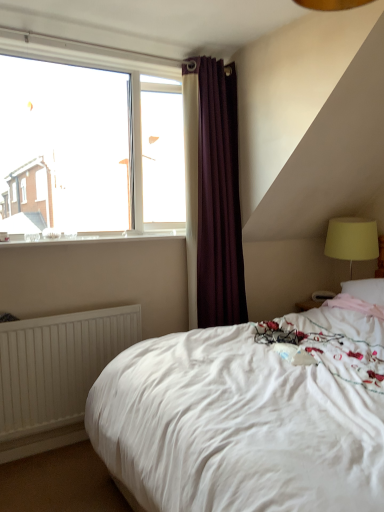
Consider the image. Measure the distance between dark purple velvet curtain at upper center and camera.

dark purple velvet curtain at upper center and camera are 8.39 feet apart.

This screenshot has width=384, height=512. I want to click on clear glass window at upper left, so click(x=89, y=148).

Image resolution: width=384 pixels, height=512 pixels. I want to click on white glossy window sill at upper left, so click(x=90, y=238).

Considering the relative sizes of clear glass window at upper left and white matte radiator at lower left in the image provided, is clear glass window at upper left smaller than white matte radiator at lower left?

No, clear glass window at upper left is not smaller than white matte radiator at lower left.

Is clear glass window at upper left in front of or behind white matte radiator at lower left in the image?

In the image, clear glass window at upper left appears behind white matte radiator at lower left.

Considering the sizes of objects white glossy window sill at upper left and yellow fabric lampshade at right in the image provided, who is thinner, white glossy window sill at upper left or yellow fabric lampshade at right?

With smaller width is white glossy window sill at upper left.

Is white glossy window sill at upper left at the right side of yellow fabric lampshade at right?

No.

At what (x,y) coordinates should I click in order to perform the action: click on lamp beneath the white glossy window sill at upper left (from a real-world perspective). Please return your answer as a coordinate pair (x, y). This screenshot has height=512, width=384. Looking at the image, I should click on (352, 240).

Based on the photo, is the position of clear glass window at upper left more distant than that of yellow fabric lampshade at right?

That is False.

Is clear glass window at upper left wider than yellow fabric lampshade at right?

No, clear glass window at upper left is not wider than yellow fabric lampshade at right.

Considering the relative sizes of clear glass window at upper left and yellow fabric lampshade at right in the image provided, is clear glass window at upper left taller than yellow fabric lampshade at right?

Yes.

Considering the relative sizes of clear glass window at upper left and yellow fabric lampshade at right in the image provided, is clear glass window at upper left bigger than yellow fabric lampshade at right?

Yes, clear glass window at upper left is bigger than yellow fabric lampshade at right.

Is white soft bed at center not inside dark purple velvet curtain at upper center?

white soft bed at center lies outside dark purple velvet curtain at upper center's area.

How far apart are white soft bed at center and dark purple velvet curtain at upper center?

white soft bed at center and dark purple velvet curtain at upper center are 3.74 feet apart from each other.

Which object is thinner, white soft bed at center or dark purple velvet curtain at upper center?

With smaller width is dark purple velvet curtain at upper center.

Is point (156, 499) positioned after point (206, 324)?

That is False.

Is yellow fabric lampshade at right taller or shorter than clear glass window at upper left?

In the image, yellow fabric lampshade at right appears to be shorter than clear glass window at upper left.

Does yellow fabric lampshade at right touch clear glass window at upper left?

No, yellow fabric lampshade at right is not touching clear glass window at upper left.

Can you tell me how much yellow fabric lampshade at right and clear glass window at upper left differ in facing direction?

The angle between the facing direction of yellow fabric lampshade at right and the facing direction of clear glass window at upper left is 88 degrees.

From a real-world perspective, is yellow fabric lampshade at right physically above clear glass window at upper left?

Actually, yellow fabric lampshade at right is physically below clear glass window at upper left in the real world.

Considering the relative sizes of white soft bed at center and yellow fabric lampshade at right in the image provided, is white soft bed at center shorter than yellow fabric lampshade at right?

Incorrect, the height of white soft bed at center does not fall short of that of yellow fabric lampshade at right.

Are white soft bed at center and yellow fabric lampshade at right making contact?

No, white soft bed at center is not making contact with yellow fabric lampshade at right.

Which object is more forward, white soft bed at center or yellow fabric lampshade at right?

white soft bed at center is more forward.

At what (x,y) coordinates should I click in order to perform the action: click on lamp located above the white soft bed at center (from the image's perspective). Please return your answer as a coordinate pair (x, y). Image resolution: width=384 pixels, height=512 pixels. Looking at the image, I should click on (352, 240).

This screenshot has height=512, width=384. Identify the location of radiator below the white soft bed at center (from a real-world perspective). (57, 366).

Between white matte radiator at lower left and white soft bed at center, which one has larger size?

white soft bed at center is bigger.

In the scene shown: From the image's perspective, who appears lower, white matte radiator at lower left or white soft bed at center?

From the image's view, white matte radiator at lower left is below.

What are the coordinates of `window that is above the white matte radiator at lower left (from the image's perspective)` in the screenshot? It's located at (89, 148).

You are a GUI agent. You are given a task and a screenshot of the screen. Output one action in this format:
    pyautogui.click(x=<x>, y=<y>)
    Task: Click on the window sill above the yellow fabric lampshade at right (from a real-world perspective)
    Image resolution: width=384 pixels, height=512 pixels.
    Given the screenshot: What is the action you would take?
    pyautogui.click(x=90, y=238)

From the image, which object appears to be farther from dark purple velvet curtain at upper center, yellow fabric lampshade at right or white soft bed at center?

white soft bed at center is further to dark purple velvet curtain at upper center.

When comparing their distances from white glossy window sill at upper left, does yellow fabric lampshade at right or white soft bed at center seem closer?

white soft bed at center.

Considering their positions, is white matte radiator at lower left positioned further to yellow fabric lampshade at right than dark purple velvet curtain at upper center?

white matte radiator at lower left lies further to yellow fabric lampshade at right than the other object.

From the image, which object appears to be farther from clear glass window at upper left, yellow fabric lampshade at right or white matte radiator at lower left?

Among the two, yellow fabric lampshade at right is located further to clear glass window at upper left.

From the image, which object appears to be farther from white matte radiator at lower left, yellow fabric lampshade at right or dark purple velvet curtain at upper center?

yellow fabric lampshade at right lies further to white matte radiator at lower left than the other object.

From the image, which object appears to be nearer to clear glass window at upper left, yellow fabric lampshade at right or white soft bed at center?

Among the two, white soft bed at center is located nearer to clear glass window at upper left.

Which object lies further to the anchor point white glossy window sill at upper left, dark purple velvet curtain at upper center or clear glass window at upper left?

dark purple velvet curtain at upper center.

Which object lies further to the anchor point white matte radiator at lower left, white glossy window sill at upper left or yellow fabric lampshade at right?

Among the two, yellow fabric lampshade at right is located further to white matte radiator at lower left.

This screenshot has width=384, height=512. I want to click on radiator between white soft bed at center and yellow fabric lampshade at right in the front-back direction, so click(x=57, y=366).

This screenshot has height=512, width=384. What are the coordinates of `window between white soft bed at center and yellow fabric lampshade at right in the front-back direction` in the screenshot? It's located at (89, 148).

This screenshot has width=384, height=512. Find the location of `window sill positioned between white soft bed at center and dark purple velvet curtain at upper center from near to far`. window sill positioned between white soft bed at center and dark purple velvet curtain at upper center from near to far is located at coordinates (90, 238).

Find the location of `window between white matte radiator at lower left and yellow fabric lampshade at right`. window between white matte radiator at lower left and yellow fabric lampshade at right is located at coordinates (89, 148).